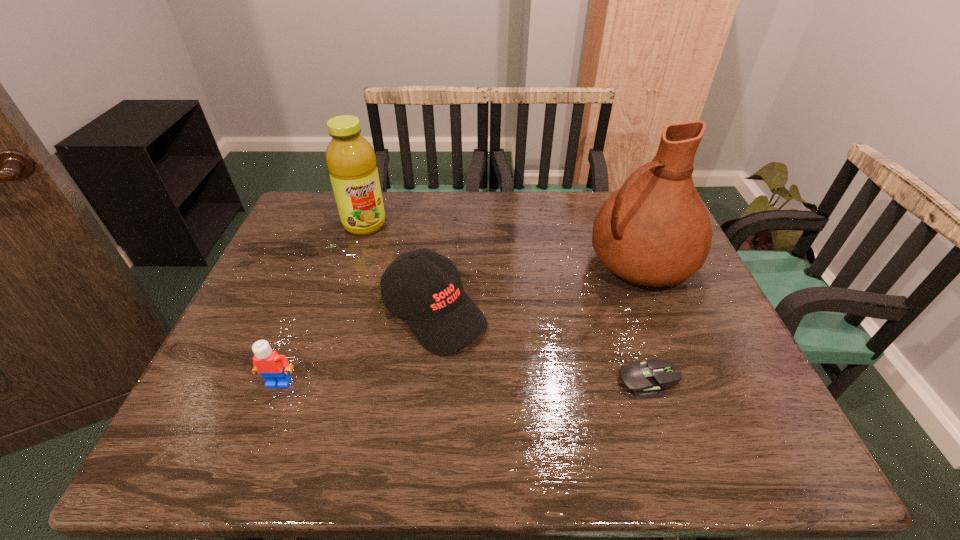
Identify the location of object present at the right edge. The height and width of the screenshot is (540, 960). (655, 230).

This screenshot has width=960, height=540. Find the location of `object at the near left corner`. object at the near left corner is located at coordinates 273,367.

This screenshot has height=540, width=960. Find the location of `object located at the far right corner`. object located at the far right corner is located at coordinates (655, 230).

Locate an element on the screen. This screenshot has height=540, width=960. vacant space at the far edge of the desktop is located at coordinates (568, 212).

Locate an element on the screen. The height and width of the screenshot is (540, 960). vacant area at the left edge of the desktop is located at coordinates (261, 323).

I want to click on vacant space at the right edge of the desktop, so click(673, 304).

You are a GUI agent. You are given a task and a screenshot of the screen. Output one action in this format:
    pyautogui.click(x=<x>, y=<y>)
    Task: Click on the blank region between the fruit juice and the Lego
    
    Given the screenshot: What is the action you would take?
    pyautogui.click(x=322, y=303)

Identify the location of free space between the pitcher and the second tallest object. The width and height of the screenshot is (960, 540). (503, 245).

Find the location of `free space between the Lego and the shortest object`. free space between the Lego and the shortest object is located at coordinates (464, 381).

Where is `free space between the shortest object and the Lego`? This screenshot has height=540, width=960. free space between the shortest object and the Lego is located at coordinates (464, 381).